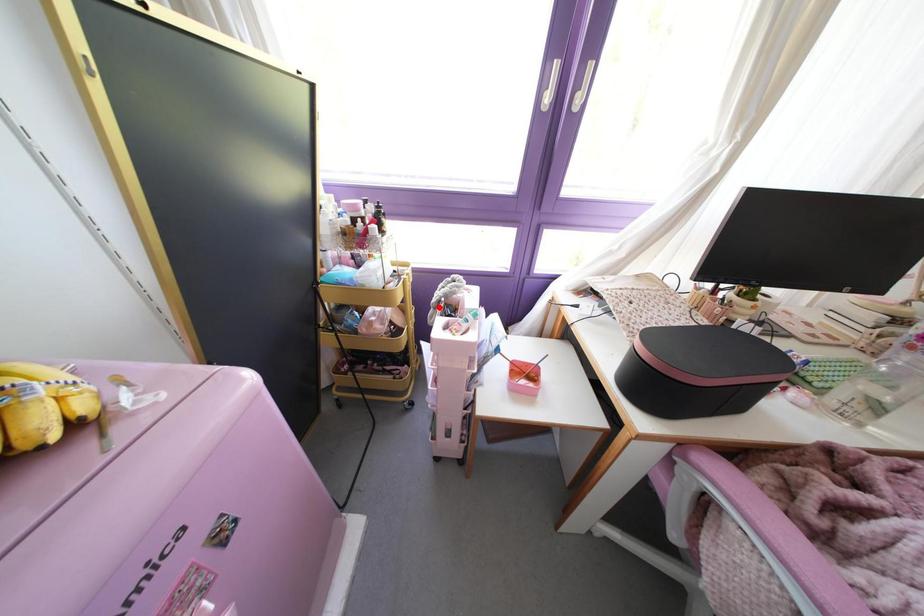
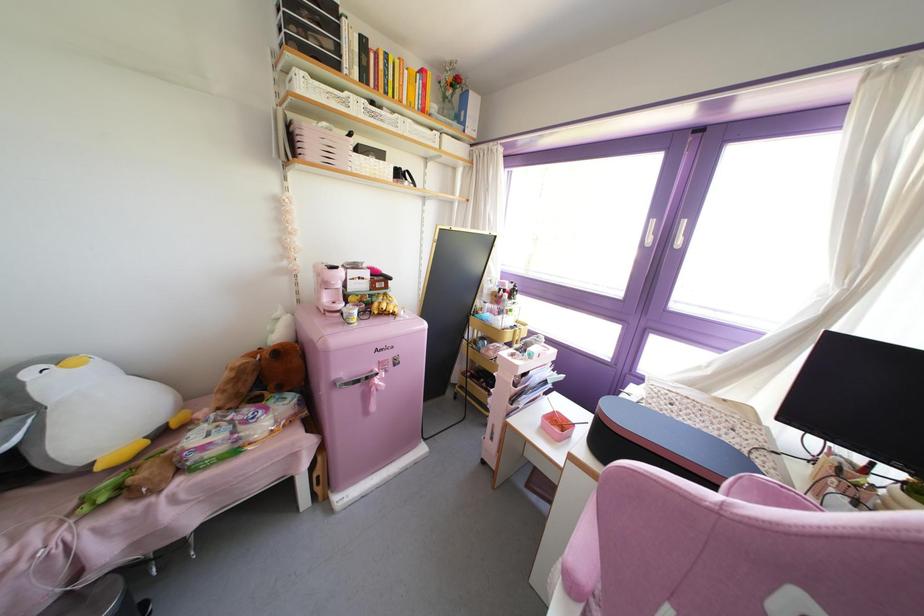
Locate, in the second image, the point that corresponds to the highlighted location in the first image.

(516, 345)